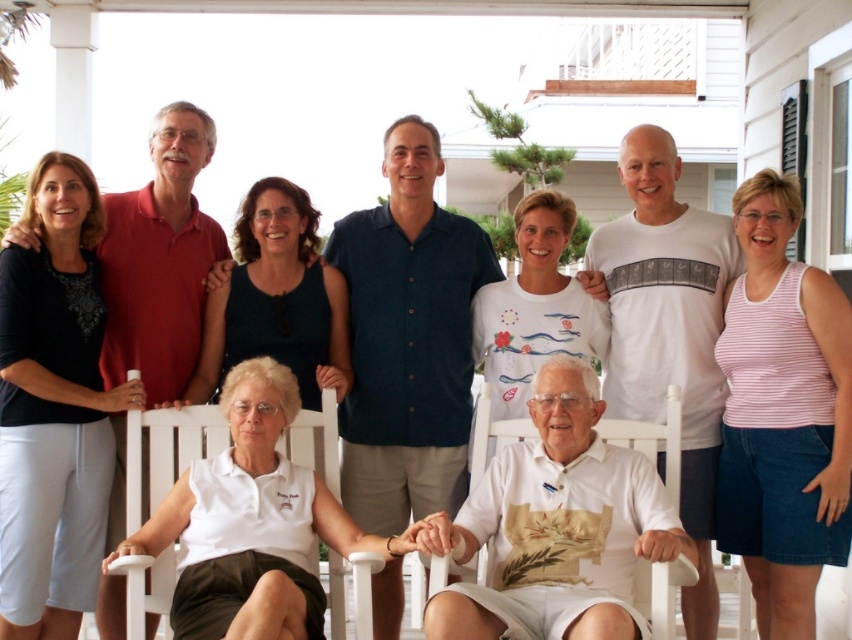
Question: Which object appears farthest from the camera in this image?

Choices:
 (A) white plastic chair at center
 (B) white wood chair at lower center

Answer: (B)

Question: Does white wood chair at lower center have a larger size compared to white plastic chair at center?

Choices:
 (A) no
 (B) yes

Answer: (B)

Question: Is white wood chair at lower center to the left of white plastic chair at center from the viewer's perspective?

Choices:
 (A) yes
 (B) no

Answer: (A)

Question: Does white wood chair at lower center appear over white plastic chair at center?

Choices:
 (A) no
 (B) yes

Answer: (A)

Question: Among these points, which one is farthest from the camera?

Choices:
 (A) (655, 580)
 (B) (329, 595)

Answer: (B)

Question: Among these points, which one is farthest from the camera?

Choices:
 (A) 666,460
 (B) 186,433

Answer: (B)